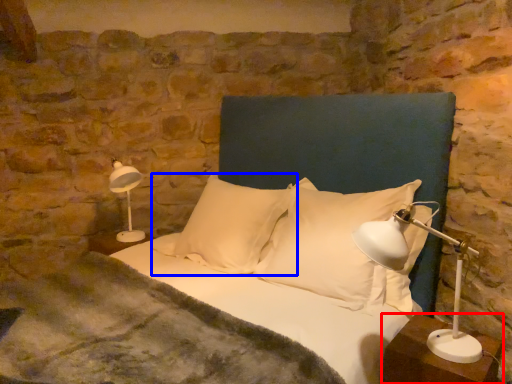
Question: Which object is closer to the camera taking this photo, nightstand (highlighted by a red box) or pillow (highlighted by a blue box)?

Choices:
 (A) nightstand
 (B) pillow

Answer: (A)